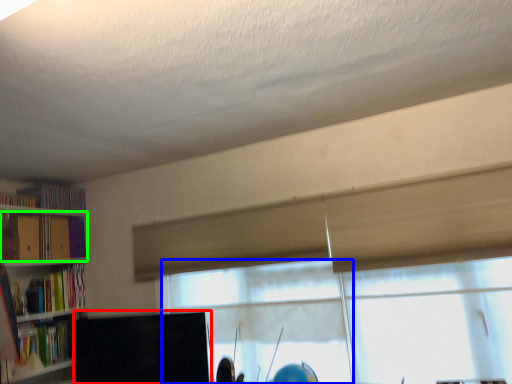
Question: Based on their relative distances, which object is farther from computer monitor (highlighted by a red box)? Choose from window (highlighted by a blue box) and book (highlighted by a green box).

Choices:
 (A) window
 (B) book

Answer: (B)